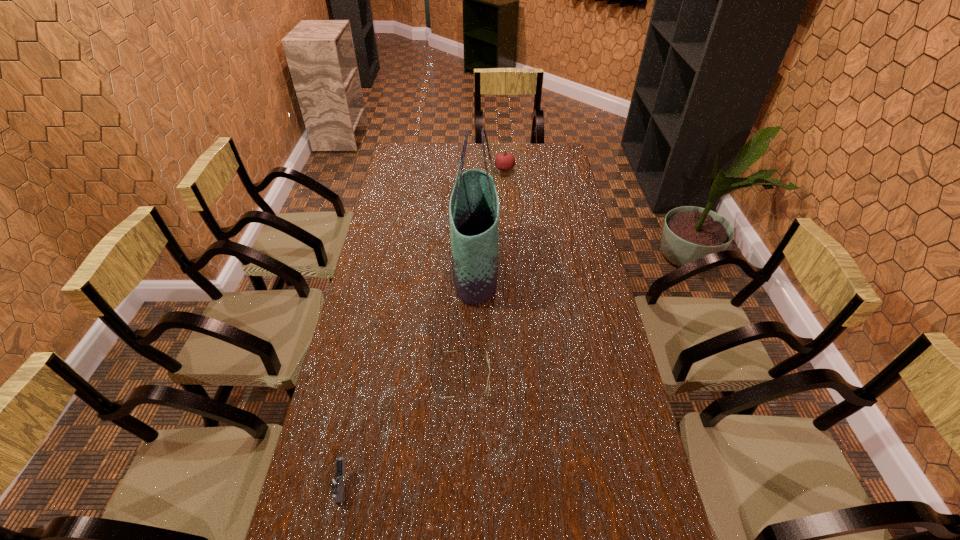
At what (x,y) coordinates should I click in order to perform the action: click on vacant space located on the right of the nearest object. Please return your answer as a coordinate pair (x, y). The width and height of the screenshot is (960, 540). Looking at the image, I should click on (386, 484).

Locate an element on the screen. The height and width of the screenshot is (540, 960). vacant space located on the front-facing side of the spectacles is located at coordinates (536, 378).

Where is `object present at the far edge`? object present at the far edge is located at coordinates (505, 161).

You are a GUI agent. You are given a task and a screenshot of the screen. Output one action in this format:
    pyautogui.click(x=<x>, y=<y>)
    Task: Click on the object at the left edge
    Image resolution: width=960 pixels, height=540 pixels.
    Given the screenshot: What is the action you would take?
    pyautogui.click(x=336, y=483)

Where is `vacant space at the far edge of the desktop`? vacant space at the far edge of the desktop is located at coordinates (520, 153).

Where is `blank space at the left edge`? The image size is (960, 540). blank space at the left edge is located at coordinates (367, 259).

The image size is (960, 540). In order to click on vacant space at the right edge of the desktop in this screenshot , I will do `click(565, 303)`.

In the image, there is a desktop. Where is `vacant space at the far left corner`? The width and height of the screenshot is (960, 540). vacant space at the far left corner is located at coordinates (405, 164).

Where is `free space at the far right corner of the desktop`? The width and height of the screenshot is (960, 540). free space at the far right corner of the desktop is located at coordinates (547, 148).

Locate an element on the screen. The width and height of the screenshot is (960, 540). blank region between the tote bag and the nearest object is located at coordinates (409, 376).